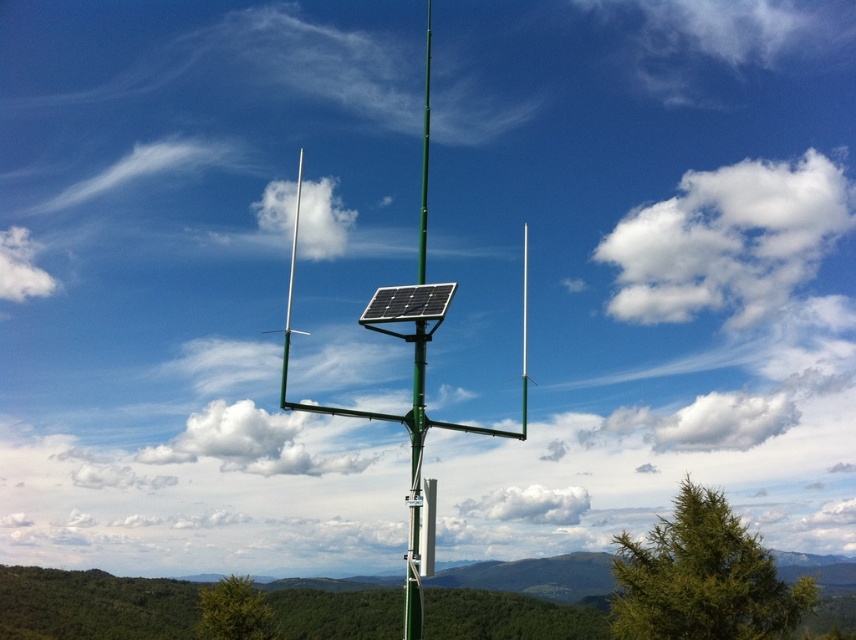
You are an engineer inspecting the communication station. You need to determine the relative positions of the green metallic antenna at center and the black rigid solar panel at center. Which object is located to the right of the other?

The green metallic antenna at center is positioned on the right side of the black rigid solar panel at center, so the green metallic antenna at center is to the right of the black rigid solar panel at center.